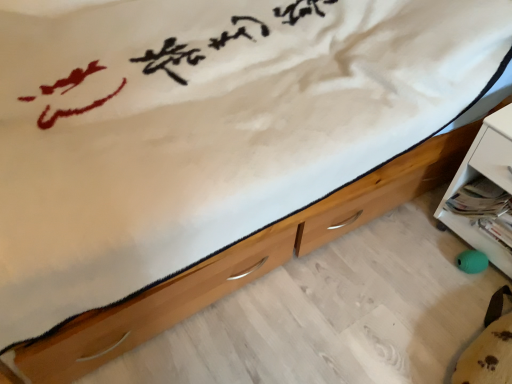
Measure the distance between white glossy cabinet at lower right and camera.

white glossy cabinet at lower right is 4.01 feet away from camera.

At what (x,y) coordinates should I click in order to perform the action: click on white glossy cabinet at lower right. Please return your answer as a coordinate pair (x, y). The height and width of the screenshot is (384, 512). Looking at the image, I should click on (484, 191).

What do you see at coordinates (484, 191) in the screenshot? The height and width of the screenshot is (384, 512). I see `white glossy cabinet at lower right` at bounding box center [484, 191].

At what (x,y) coordinates should I click in order to perform the action: click on white glossy cabinet at lower right. Please return your answer as a coordinate pair (x, y). Looking at the image, I should click on (484, 191).